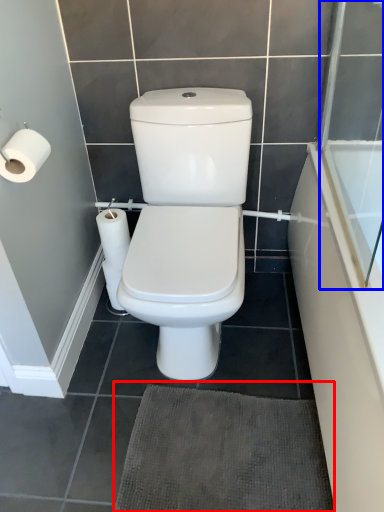
Question: Which point is closer to the camera, bath mat (highlighted by a red box) or screen door (highlighted by a blue box)?

Choices:
 (A) bath mat
 (B) screen door

Answer: (B)